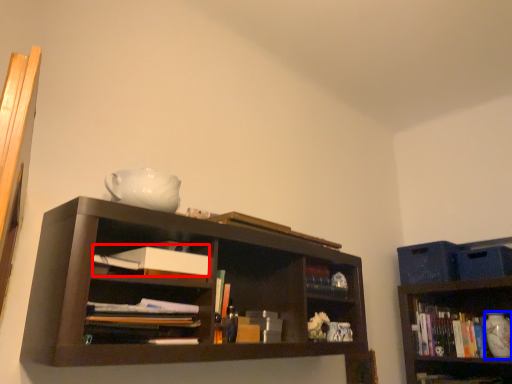
Question: Which object appears farthest to the camera in this image, paperback book (highlighted by a red box) or glass vase (highlighted by a blue box)?

Choices:
 (A) paperback book
 (B) glass vase

Answer: (B)